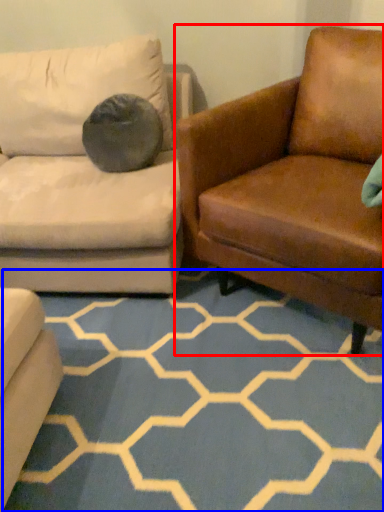
Question: Which object appears farthest to the camera in this image, studio couch (highlighted by a red box) or pattern (highlighted by a blue box)?

Choices:
 (A) studio couch
 (B) pattern

Answer: (B)